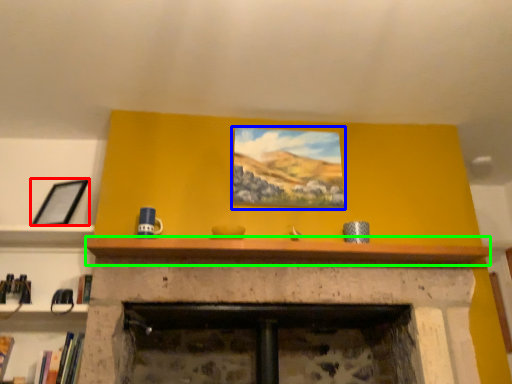
Question: Estimate the real-world distances between objects in this image. Which object is farther from picture frame (highlighted by a red box), picture frame (highlighted by a blue box) or mantle (highlighted by a green box)?

Choices:
 (A) picture frame
 (B) mantle

Answer: (A)